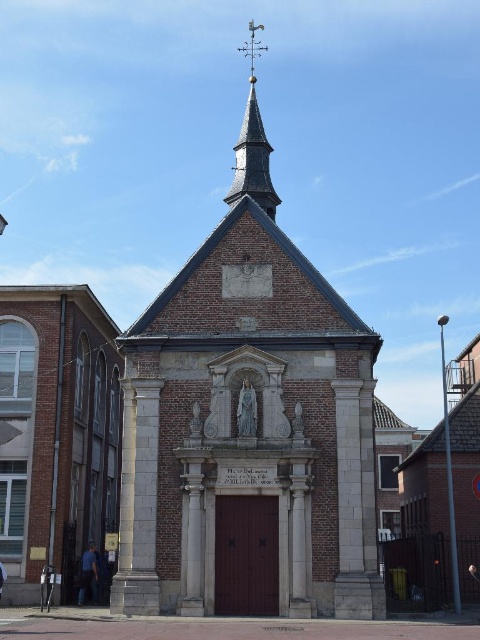
Based on the scene description, which object is wider, the white stone tower at center or the smooth brown spire at upper center?

The white stone tower at center is wider than the smooth brown spire at upper center according to the description.

Based on the photo, you are an architect evaluating the historic building. You need to determine which object, the white stone tower at center or the smooth brown spire at upper center, is bigger in size. Which one is larger?

The white stone tower at center is larger in size than the smooth brown spire at upper center according to the description.